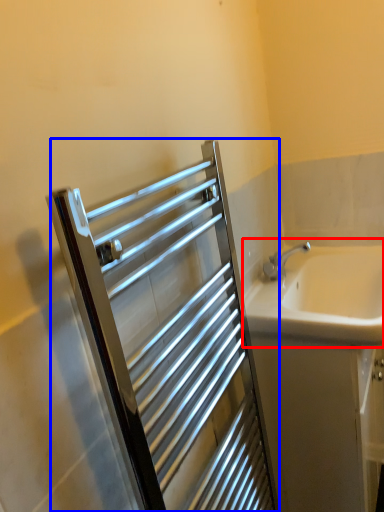
Question: Which point is further to the camera, sink (highlighted by a red box) or screen door (highlighted by a blue box)?

Choices:
 (A) sink
 (B) screen door

Answer: (A)